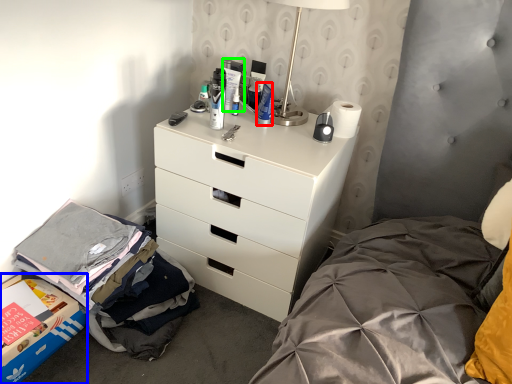
Question: Considering the real-world distances, which object is farthest from toiletry (highlighted by a red box)? storage box (highlighted by a blue box) or toiletry (highlighted by a green box)?

Choices:
 (A) storage box
 (B) toiletry

Answer: (A)